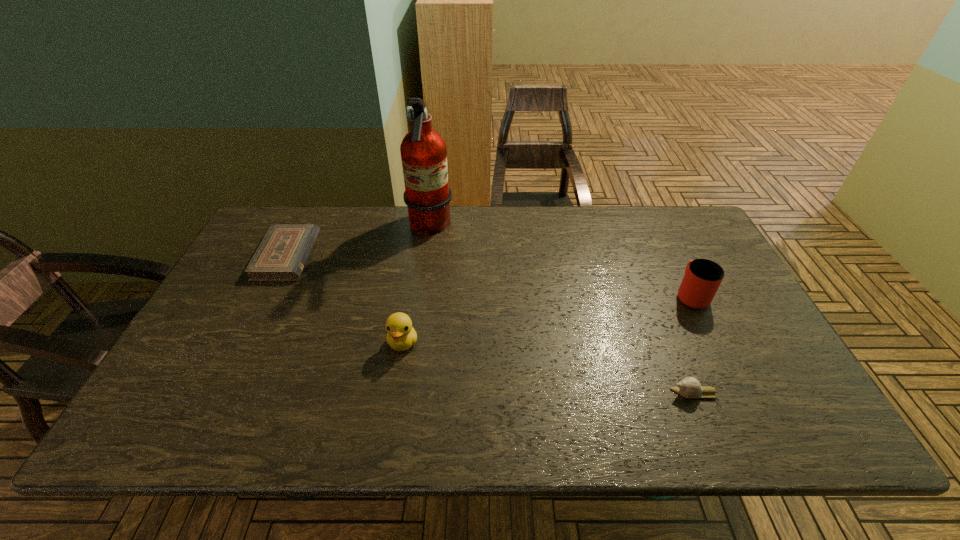
Where is `free space between the rightmost object and the fourth object from left to right`? free space between the rightmost object and the fourth object from left to right is located at coordinates (693, 344).

Where is `unoccupied position between the fourth object from left to right and the fire extinguisher`? The height and width of the screenshot is (540, 960). unoccupied position between the fourth object from left to right and the fire extinguisher is located at coordinates (563, 310).

The height and width of the screenshot is (540, 960). Find the location of `empty location between the duck and the cup`. empty location between the duck and the cup is located at coordinates (547, 319).

This screenshot has height=540, width=960. What are the coordinates of `free area in between the rightmost object and the shortest object` in the screenshot? It's located at (489, 275).

The image size is (960, 540). In order to click on vacant space that's between the rightmost object and the shortest object in this screenshot , I will do `click(489, 275)`.

Select which object is the third closest to the fourth tallest object. Please provide its 2D coordinates. Your answer should be formatted as a tuple, i.e. [(x, y)], where the tuple contains the x and y coordinates of a point satisfying the conditions above.

[(427, 195)]

Identify the location of object that is the closest one to the second nearest object. The image size is (960, 540). pos(427,195).

This screenshot has width=960, height=540. In order to click on vacant position in the image that satisfies the following two spatial constraints: 1. on the nozzle and handle of the fire extinguisher; 2. on the face of the second nearest object in this screenshot , I will do `click(414, 342)`.

Locate an element on the screen. This screenshot has width=960, height=540. free region that satisfies the following two spatial constraints: 1. on the nozzle and handle of the fire extinguisher; 2. on the handle side of the rightmost object is located at coordinates (420, 294).

At what (x,y) coordinates should I click in order to perform the action: click on vacant region that satisfies the following two spatial constraints: 1. on the nozzle and handle of the tallest object; 2. on the handle side of the cup. Please return your answer as a coordinate pair (x, y). Looking at the image, I should click on (420, 294).